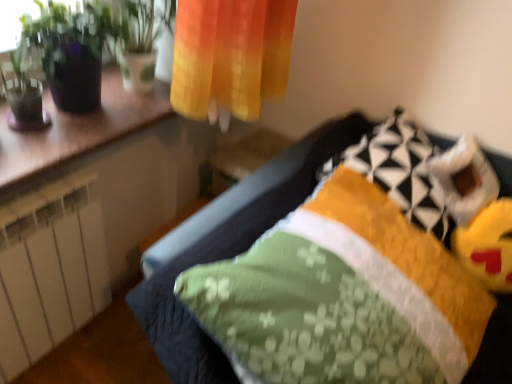
What do you see at coordinates (71, 50) in the screenshot? The width and height of the screenshot is (512, 384). I see `green glossy plant at upper left` at bounding box center [71, 50].

Where is `yellow quilted pillow at upper right, arranged as the 2th pillow when ordered from the bottom`? yellow quilted pillow at upper right, arranged as the 2th pillow when ordered from the bottom is located at coordinates (399, 170).

Which object is wider, green glossy plant at upper left or green fabric pillow at center, the 1th pillow positioned from the bottom?

With larger width is green fabric pillow at center, the 1th pillow positioned from the bottom.

Between green glossy plant at upper left and green fabric pillow at center, which is the second pillow from top to bottom, which one appears on the left side from the viewer's perspective?

Positioned to the left is green glossy plant at upper left.

How far apart are green glossy plant at upper left and green fabric pillow at center, the 1th pillow positioned from the bottom?

The distance of green glossy plant at upper left from green fabric pillow at center, the 1th pillow positioned from the bottom, is 32.23 inches.

Is green glossy plant at upper left far from green fabric pillow at center, which is the second pillow from top to bottom?

Actually, green glossy plant at upper left and green fabric pillow at center, which is the second pillow from top to bottom, are a little close together.

From a real-world perspective, does green glossy plant at upper left stand above wooden counter at upper left?

Correct, in the physical world, green glossy plant at upper left is higher than wooden counter at upper left.

Is green glossy plant at upper left closer to the viewer compared to wooden counter at upper left?

No, green glossy plant at upper left is further to the viewer.

From the image's perspective, is green glossy plant at upper left under wooden counter at upper left?

No, from the image's perspective, green glossy plant at upper left is not below wooden counter at upper left.

Looking at their sizes, would you say green glossy plant at upper left is wider or thinner than wooden counter at upper left?

green glossy plant at upper left is thinner than wooden counter at upper left.

Is yellow plush toy at lower right at the back of green fabric pillow at center, which is the second pillow from top to bottom?

No, green fabric pillow at center, which is the second pillow from top to bottom, is not facing the opposite direction of yellow plush toy at lower right.

Is the position of green fabric pillow at center, which is the second pillow from top to bottom, more distant than that of yellow plush toy at lower right?

No, it is in front of yellow plush toy at lower right.

Is green fabric pillow at center, the 1th pillow positioned from the bottom, placed right next to yellow plush toy at lower right?

green fabric pillow at center, the 1th pillow positioned from the bottom, and yellow plush toy at lower right are not in contact.

Considering the sizes of objects green glossy plant at upper left and yellow quilted pillow at upper right, arranged as the 2th pillow when ordered from the bottom, in the image provided, who is bigger, green glossy plant at upper left or yellow quilted pillow at upper right, arranged as the 2th pillow when ordered from the bottom,?

With larger size is yellow quilted pillow at upper right, arranged as the 2th pillow when ordered from the bottom.

Who is taller, green glossy plant at upper left or yellow quilted pillow at upper right, the first pillow from the top?

green glossy plant at upper left is taller.

Is green glossy plant at upper left inside or outside of yellow quilted pillow at upper right, arranged as the 2th pillow when ordered from the bottom?

green glossy plant at upper left cannot be found inside yellow quilted pillow at upper right, arranged as the 2th pillow when ordered from the bottom.

Between green glossy plant at upper left and yellow quilted pillow at upper right, the first pillow from the top, which one is positioned behind?

yellow quilted pillow at upper right, the first pillow from the top, is behind.

From a real-world perspective, is green fabric pillow at center, which is the second pillow from top to bottom, located higher than green glossy plant at upper left?

No, from a real-world perspective, green fabric pillow at center, which is the second pillow from top to bottom, is not over green glossy plant at upper left

Consider the image. Is green fabric pillow at center, which is the second pillow from top to bottom, at the left side of green glossy plant at upper left?

No.

Which of these two, green fabric pillow at center, the 1th pillow positioned from the bottom, or green glossy plant at upper left, stands taller?

With more height is green fabric pillow at center, the 1th pillow positioned from the bottom.

From a real-world perspective, which pillow is the 2nd one underneath the green glossy plant at upper left? Please provide its 2D coordinates.

[(343, 296)]

From a real-world perspective, is yellow plush toy at lower right above or below green fabric pillow at center, which is the second pillow from top to bottom?

yellow plush toy at lower right is below green fabric pillow at center, which is the second pillow from top to bottom.

In the scene shown: Is yellow plush toy at lower right closer to camera compared to green fabric pillow at center, which is the second pillow from top to bottom?

No, yellow plush toy at lower right is further to the viewer.

Does yellow plush toy at lower right have a smaller size compared to green fabric pillow at center, which is the second pillow from top to bottom?

Yes, yellow plush toy at lower right is smaller than green fabric pillow at center, which is the second pillow from top to bottom.

From the yellow plush toy at lower right, count 2nd pillows forward and point to it. Please provide its 2D coordinates.

[(343, 296)]

From a real-world perspective, is yellow quilted pillow at upper right, the first pillow from the top, on top of yellow plush toy at lower right?

Correct, in the physical world, yellow quilted pillow at upper right, the first pillow from the top, is higher than yellow plush toy at lower right.

Is yellow plush toy at lower right inside yellow quilted pillow at upper right, the first pillow from the top?

No, yellow plush toy at lower right is not a part of yellow quilted pillow at upper right, the first pillow from the top.

From their relative heights in the image, would you say yellow quilted pillow at upper right, arranged as the 2th pillow when ordered from the bottom, is taller or shorter than yellow plush toy at lower right?

Considering their sizes, yellow quilted pillow at upper right, arranged as the 2th pillow when ordered from the bottom, has more height than yellow plush toy at lower right.

How different are the orientations of yellow quilted pillow at upper right, arranged as the 2th pillow when ordered from the bottom, and yellow plush toy at lower right in degrees?

75.6 degrees.

Where is `houseplant on the left of the green fabric pillow at center, which is the second pillow from top to bottom`? houseplant on the left of the green fabric pillow at center, which is the second pillow from top to bottom is located at coordinates (71, 50).

Find the location of a particular element. houseplant above the wooden counter at upper left (from the image's perspective) is located at coordinates (71, 50).

Based on their spatial positions, is green glossy plant at upper left or yellow quilted pillow at upper right, arranged as the 2th pillow when ordered from the bottom, closer to wooden counter at upper left?

green glossy plant at upper left is positioned closer to the anchor wooden counter at upper left.

When comparing their distances from green fabric pillow at center, which is the second pillow from top to bottom, does wooden counter at upper left or green glossy plant at upper left seem further?

Based on the image, green glossy plant at upper left appears to be further to green fabric pillow at center, which is the second pillow from top to bottom.

Based on their spatial positions, is green fabric pillow at center, which is the second pillow from top to bottom, or green glossy plant at upper left further from yellow plush toy at lower right?

green glossy plant at upper left.

Looking at this image, considering their positions, is yellow quilted pillow at upper right, arranged as the 2th pillow when ordered from the bottom, positioned closer to green glossy plant at upper left than yellow plush toy at lower right?

yellow quilted pillow at upper right, arranged as the 2th pillow when ordered from the bottom.

Based on their spatial positions, is yellow plush toy at lower right or green fabric pillow at center, which is the second pillow from top to bottom, closer to yellow quilted pillow at upper right, arranged as the 2th pillow when ordered from the bottom?

yellow plush toy at lower right is closer to yellow quilted pillow at upper right, arranged as the 2th pillow when ordered from the bottom.

Looking at the image, which one is located closer to yellow plush toy at lower right, wooden counter at upper left or green fabric pillow at center, which is the second pillow from top to bottom?

green fabric pillow at center, which is the second pillow from top to bottom.

When comparing their distances from wooden counter at upper left, does yellow plush toy at lower right or green glossy plant at upper left seem further?

Among the two, yellow plush toy at lower right is located further to wooden counter at upper left.

From the image, which object appears to be nearer to green fabric pillow at center, the 1th pillow positioned from the bottom, yellow quilted pillow at upper right, the first pillow from the top, or wooden counter at upper left?

The object closer to green fabric pillow at center, the 1th pillow positioned from the bottom, is yellow quilted pillow at upper right, the first pillow from the top.

What are the coordinates of `houseplant located between wooden counter at upper left and green fabric pillow at center, which is the second pillow from top to bottom, in the left-right direction` in the screenshot? It's located at (71, 50).

Image resolution: width=512 pixels, height=384 pixels. I want to click on houseplant between wooden counter at upper left and yellow quilted pillow at upper right, arranged as the 2th pillow when ordered from the bottom, from left to right, so click(x=71, y=50).

You are a GUI agent. You are given a task and a screenshot of the screen. Output one action in this format:
    pyautogui.click(x=<x>, y=<y>)
    Task: Click on the pillow located between green fabric pillow at center, which is the second pillow from top to bottom, and yellow plush toy at lower right in the depth direction
    
    Given the screenshot: What is the action you would take?
    pyautogui.click(x=399, y=170)

Locate an element on the screen. pillow between green glossy plant at upper left and yellow quilted pillow at upper right, arranged as the 2th pillow when ordered from the bottom is located at coordinates (343, 296).